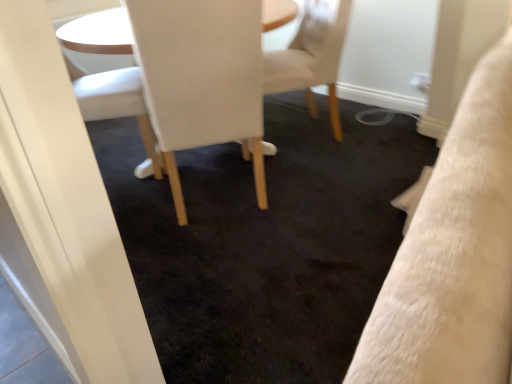
Image resolution: width=512 pixels, height=384 pixels. What do you see at coordinates (312, 56) in the screenshot?
I see `beige fabric swivel chair at center` at bounding box center [312, 56].

Find the location of a particular element. The width and height of the screenshot is (512, 384). beige fabric swivel chair at center is located at coordinates (312, 56).

Locate an element on the screen. The height and width of the screenshot is (384, 512). beige fabric swivel chair at center is located at coordinates (312, 56).